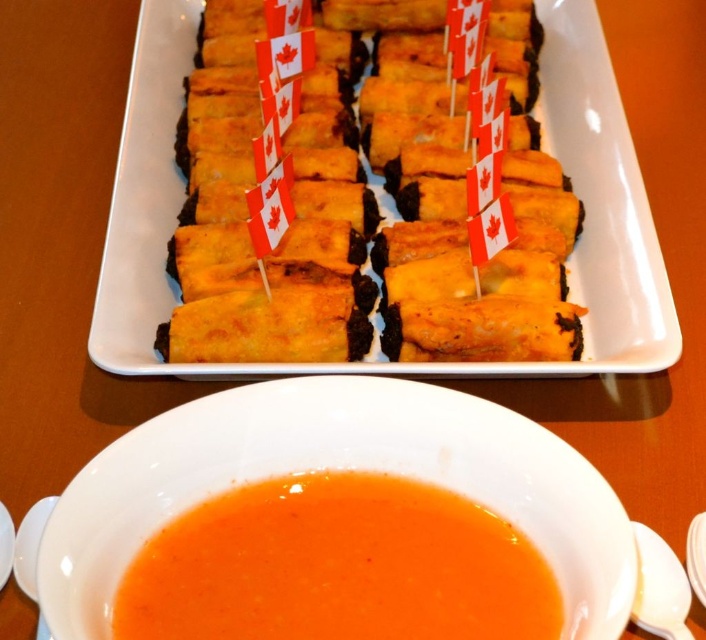
Which of these two, white ceramic bowl at center or orange smoothie at lower center, stands shorter?

orange smoothie at lower center

Can you confirm if white ceramic bowl at center is positioned above orange smoothie at lower center?

Indeed, white ceramic bowl at center is positioned over orange smoothie at lower center.

The height and width of the screenshot is (640, 706). Describe the element at coordinates (353, 468) in the screenshot. I see `white ceramic bowl at center` at that location.

Image resolution: width=706 pixels, height=640 pixels. In order to click on white ceramic bowl at center in this screenshot , I will do `click(353, 468)`.

Is golden crispy spring rolls at center wider than orange smoothie at lower center?

Yes, golden crispy spring rolls at center is wider than orange smoothie at lower center.

Where is `golden crispy spring rolls at center`? Image resolution: width=706 pixels, height=640 pixels. golden crispy spring rolls at center is located at coordinates (359, 208).

Between golden crispy spring rolls at center and white ceramic bowl at center, which one has more height?

Standing taller between the two is golden crispy spring rolls at center.

Is golden crispy spring rolls at center to the right of white ceramic bowl at center from the viewer's perspective?

Correct, you'll find golden crispy spring rolls at center to the right of white ceramic bowl at center.

Find the location of a particular element. This screenshot has height=640, width=706. golden crispy spring rolls at center is located at coordinates (359, 208).